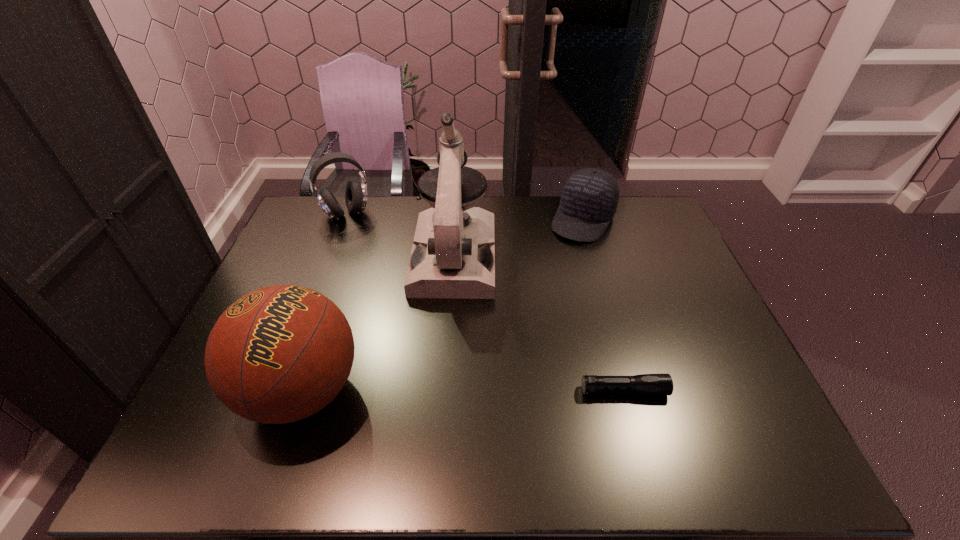
Identify the location of basketball that is positioned at the near edge. (279, 354).

Where is `flashlight located in the near edge section of the desktop`? flashlight located in the near edge section of the desktop is located at coordinates (646, 384).

In order to click on basketball positioned at the left edge in this screenshot , I will do `click(279, 354)`.

Find the location of a particular element. This screenshot has width=960, height=540. headset at the left edge is located at coordinates (356, 193).

Find the location of `object that is at the far left corner`. object that is at the far left corner is located at coordinates (356, 193).

Identify the location of object present at the near left corner. (279, 354).

The image size is (960, 540). I want to click on free region at the far edge of the desktop, so click(x=501, y=211).

This screenshot has height=540, width=960. I want to click on vacant space at the near edge, so click(578, 389).

The height and width of the screenshot is (540, 960). I want to click on vacant region at the right edge, so click(x=672, y=320).

This screenshot has width=960, height=540. I want to click on vacant position at the far left corner of the desktop, so click(x=308, y=225).